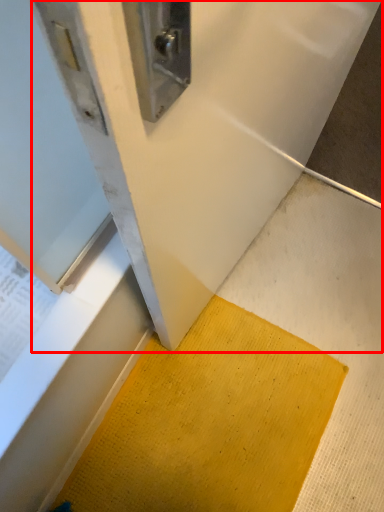
Question: Observing the image, what is the correct spatial positioning of wide (annotated by the red box) in reference to doormat?

Choices:
 (A) right
 (B) left

Answer: (A)